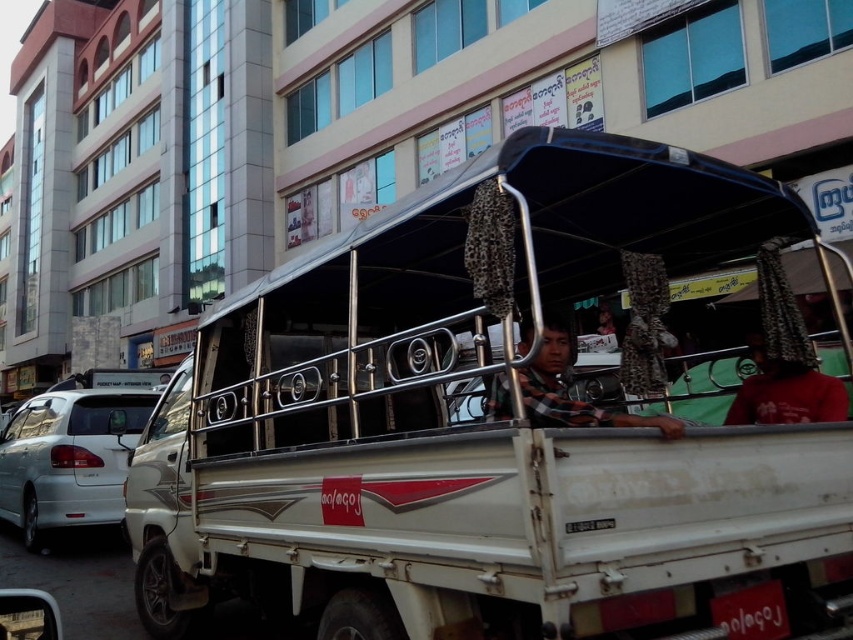
Can you confirm if white matte truck at center is positioned below checkered fabric shirt at center?

Correct, white matte truck at center is located below checkered fabric shirt at center.

Which of these two, white matte truck at center or checkered fabric shirt at center, stands taller?

Standing taller between the two is white matte truck at center.

Who is more distant from viewer, [308,307] or [566,419]?

Point [308,307]

This screenshot has width=853, height=640. In order to click on white matte truck at center in this screenshot , I will do `click(502, 419)`.

Describe the element at coordinates (567, 388) in the screenshot. I see `checkered fabric shirt at center` at that location.

Which of these two, checkered fabric shirt at center or white plastic license plate at lower right, stands shorter?

With less height is white plastic license plate at lower right.

Find the location of a particular element. This screenshot has height=640, width=853. checkered fabric shirt at center is located at coordinates (567, 388).

Locate an element on the screen. checkered fabric shirt at center is located at coordinates click(x=567, y=388).

Locate an element on the screen. white matte car at left is located at coordinates (68, 458).

Which is behind, point (126, 432) or point (541, 353)?

The point (126, 432) is more distant.

The height and width of the screenshot is (640, 853). Describe the element at coordinates (68, 458) in the screenshot. I see `white matte car at left` at that location.

Where is `white matte car at left`? The width and height of the screenshot is (853, 640). white matte car at left is located at coordinates (68, 458).